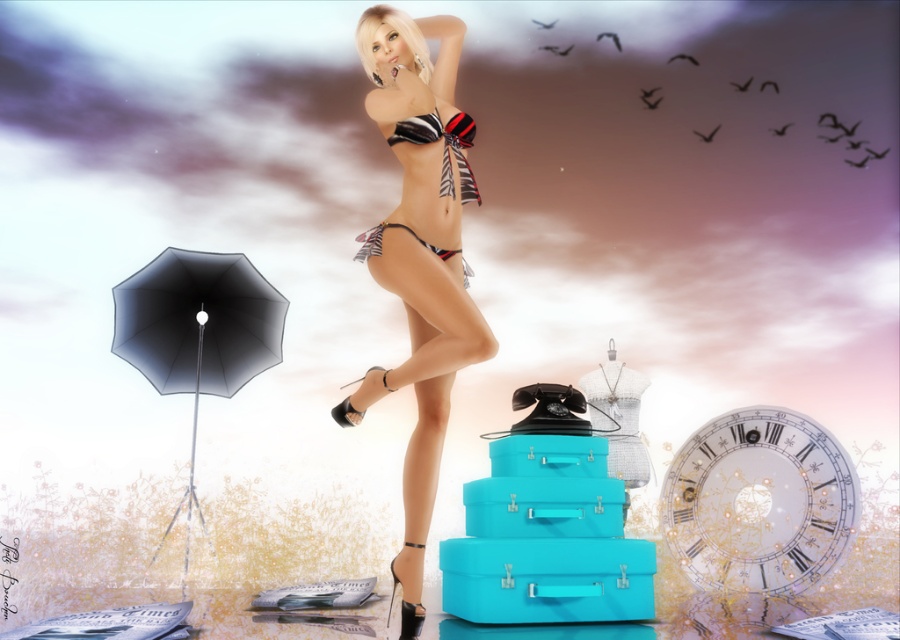
You are a photographer adjusting the lighting for a photoshoot. You notice the black matte umbrella at left and the zebra print fabric bikini at center. Which object is closer to you as you set up the camera?

The black matte umbrella at left is closer to you because it is further to the viewer than the zebra print fabric bikini at center, meaning it appears nearer in the scene.

You are a photographer setting up a photoshoot. You have a black matte umbrella at left and a zebra print fabric bikini at center. Which object would cast a larger shadow if the sun is directly overhead?

The black matte umbrella at left is larger in size than the zebra print fabric bikini at center, so it would cast a larger shadow when the sun is directly overhead.